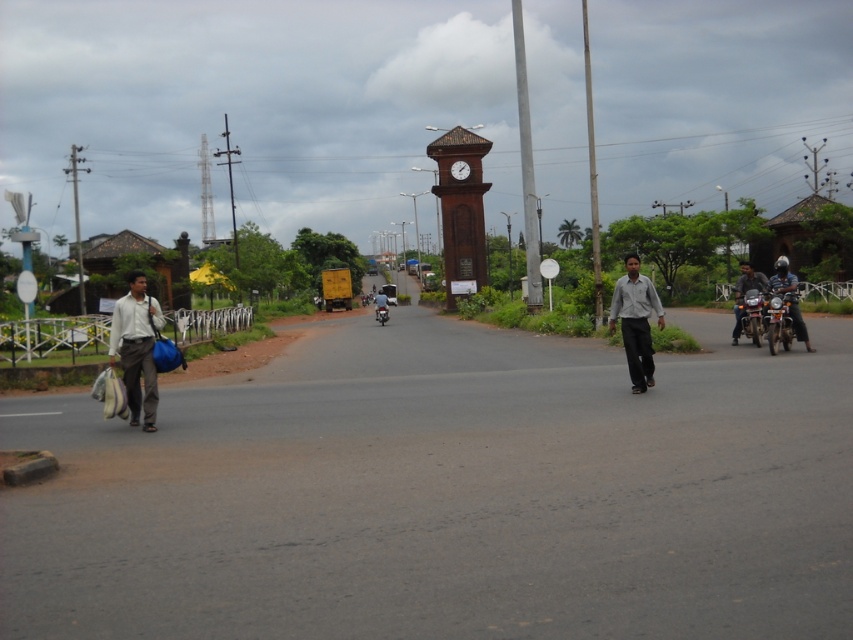
Question: Considering the real-world distances, which object is farthest from the shiny chrome motorcycle at right?

Choices:
 (A) brown wooden clock tower at center
 (B) wooden clock at center
 (C) light gray shirt at center

Answer: (B)

Question: Considering the real-world distances, which object is farthest from the brown wooden clock tower at center?

Choices:
 (A) dark blue shirt at right
 (B) shiny chrome motorcycle at right

Answer: (B)

Question: Does shiny chrome motorcycle at right appear over wooden clock at center?

Choices:
 (A) yes
 (B) no

Answer: (B)

Question: Is light gray fabric bag at left behind shiny chrome motorcycle at right?

Choices:
 (A) no
 (B) yes

Answer: (A)

Question: In this image, where is light gray fabric bag at left located relative to light gray shirt at center?

Choices:
 (A) below
 (B) above

Answer: (A)

Question: Estimate the real-world distances between objects in this image. Which object is farther from the shiny chrome motorcycle at right?

Choices:
 (A) dark blue shirt at right
 (B) light gray fabric bag at left

Answer: (B)